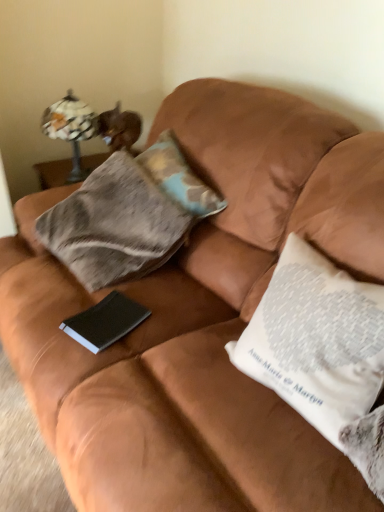
Question: Is matte glass lamp at upper left next to white printed pillow at right, which ranks as the 1th pillow in bottom-to-top order, and touching it?

Choices:
 (A) no
 (B) yes

Answer: (A)

Question: Considering the relative sizes of matte glass lamp at upper left and white printed pillow at right, arranged as the 2th pillow when viewed from the back, in the image provided, is matte glass lamp at upper left thinner than white printed pillow at right, arranged as the 2th pillow when viewed from the back,?

Choices:
 (A) no
 (B) yes

Answer: (B)

Question: Considering the relative positions of matte glass lamp at upper left and white printed pillow at right, which ranks as the 1th pillow in bottom-to-top order, in the image provided, is matte glass lamp at upper left to the left of white printed pillow at right, which ranks as the 1th pillow in bottom-to-top order, from the viewer's perspective?

Choices:
 (A) no
 (B) yes

Answer: (B)

Question: Are matte glass lamp at upper left and white printed pillow at right, which ranks as the 1th pillow in bottom-to-top order, located far from each other?

Choices:
 (A) yes
 (B) no

Answer: (A)

Question: Can you confirm if matte glass lamp at upper left is taller than white printed pillow at right, which ranks as the 1th pillow in bottom-to-top order?

Choices:
 (A) yes
 (B) no

Answer: (B)

Question: Is black matte paper at center inside or outside of camouflage fabric pillow at center, positioned as the 2th pillow in bottom-to-top order?

Choices:
 (A) inside
 (B) outside

Answer: (B)

Question: In terms of height, does black matte paper at center look taller or shorter compared to camouflage fabric pillow at center, which appears as the first pillow when viewed from the back?

Choices:
 (A) short
 (B) tall

Answer: (A)

Question: From the image's perspective, is black matte paper at center positioned above or below camouflage fabric pillow at center, positioned as the 2th pillow in bottom-to-top order?

Choices:
 (A) below
 (B) above

Answer: (A)

Question: Is point [72, 333] closer or farther from the camera than point [152, 156]?

Choices:
 (A) farther
 (B) closer

Answer: (B)

Question: Is matte glass lamp at upper left inside or outside of camouflage fabric pillow at center, positioned as the first pillow in top-to-bottom order?

Choices:
 (A) inside
 (B) outside

Answer: (B)

Question: From a real-world perspective, is matte glass lamp at upper left physically located above or below camouflage fabric pillow at center, which appears as the first pillow when viewed from the back?

Choices:
 (A) above
 (B) below

Answer: (B)

Question: Considering the positions of point (72, 120) and point (163, 144), is point (72, 120) closer or farther from the camera than point (163, 144)?

Choices:
 (A) farther
 (B) closer

Answer: (A)

Question: From the image's perspective, is matte glass lamp at upper left above or below camouflage fabric pillow at center, which appears as the first pillow when viewed from the back?

Choices:
 (A) below
 (B) above

Answer: (B)

Question: Is camouflage fabric pillow at center, which appears as the first pillow when viewed from the back, situated inside black matte paper at center or outside?

Choices:
 (A) inside
 (B) outside

Answer: (B)

Question: Is point (162, 139) closer or farther from the camera than point (102, 344)?

Choices:
 (A) closer
 (B) farther

Answer: (B)